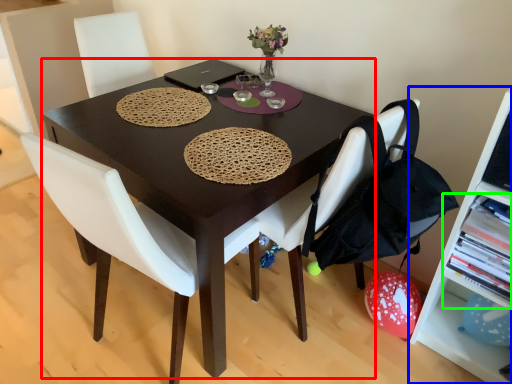
Question: Considering the real-world distances, which object is closest to desk (highlighted by a red box)? shelf (highlighted by a blue box) or shelf (highlighted by a green box).

Choices:
 (A) shelf
 (B) shelf

Answer: (B)